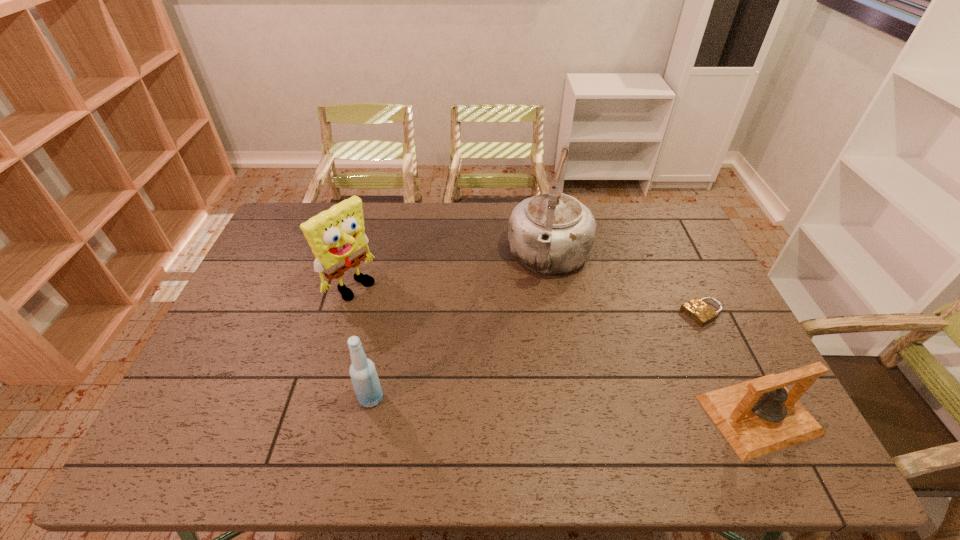
Identify the location of vacant spot on the desktop that is between the third tallest object and the fourth tallest object and is positioned at the spout of the tallest object. (511, 404).

Where is `free space on the desktop that is between the bottle and the bell and is positioned on the face of the fourth shortest object`? This screenshot has width=960, height=540. free space on the desktop that is between the bottle and the bell and is positioned on the face of the fourth shortest object is located at coordinates (518, 404).

Where is `free spot on the desktop that is between the fourth object from right to left and the bell and is positioned on the keyhole side of the shortest object`? The image size is (960, 540). free spot on the desktop that is between the fourth object from right to left and the bell and is positioned on the keyhole side of the shortest object is located at coordinates (532, 405).